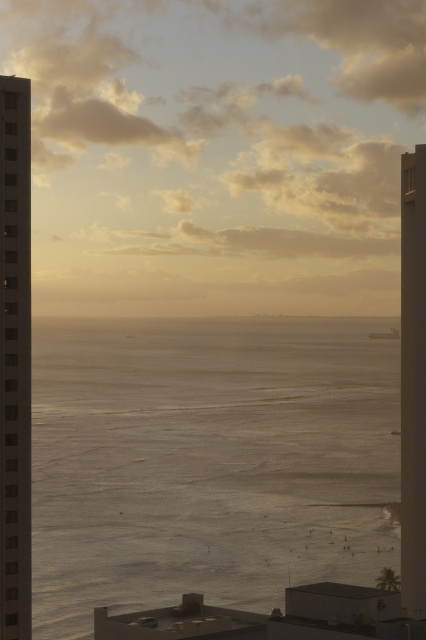
Is smooth concrete tower at left positioned at the back of smooth glass tower at right?

No, smooth concrete tower at left is closer to the viewer.

What do you see at coordinates (14, 358) in the screenshot? I see `smooth concrete tower at left` at bounding box center [14, 358].

The height and width of the screenshot is (640, 426). What are the coordinates of `smooth concrete tower at left` in the screenshot? It's located at click(x=14, y=358).

Is point (137, 454) positioned in front of point (9, 385)?

That is False.

Does golden water at center appear under smooth concrete tower at left?

Yes.

This screenshot has width=426, height=640. Describe the element at coordinates (207, 460) in the screenshot. I see `golden water at center` at that location.

The height and width of the screenshot is (640, 426). Identify the location of golden water at center. (207, 460).

Can you confirm if golden water at center is bigger than smooth glass tower at right?

Yes.

Is golden water at center above smooth glass tower at right?

No, golden water at center is not above smooth glass tower at right.

Is point (60, 468) in front of point (409, 177)?

No, (60, 468) is further to viewer.

Where is `golden water at center`? This screenshot has height=640, width=426. golden water at center is located at coordinates (207, 460).